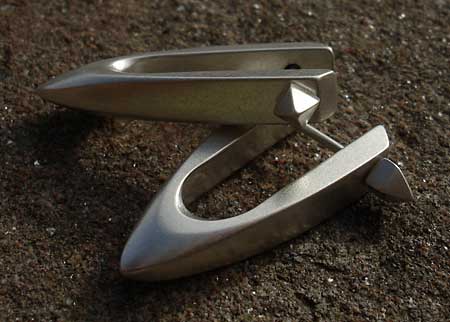
What are the coordinates of `bar` in the screenshot? It's located at (385, 180).